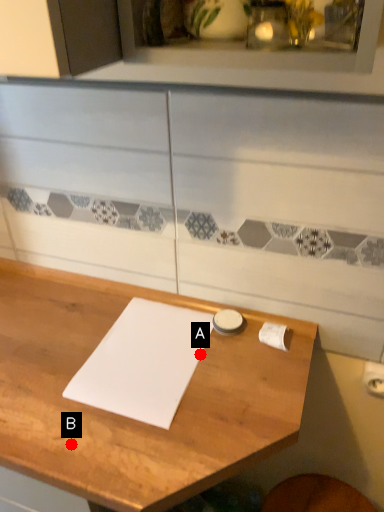
Question: Two points are circled on the image, labeled by A and B beside each circle. Which point appears farthest from the camera in this image?

Choices:
 (A) A is further
 (B) B is further

Answer: (A)